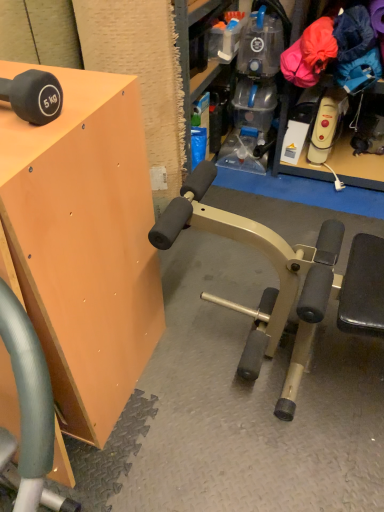
Question: Does matte black dumbbell at upper left have a greater height compared to matte orange cabinet at upper left?

Choices:
 (A) no
 (B) yes

Answer: (A)

Question: Considering the relative sizes of matte black dumbbell at upper left and matte orange cabinet at upper left in the image provided, is matte black dumbbell at upper left shorter than matte orange cabinet at upper left?

Choices:
 (A) no
 (B) yes

Answer: (B)

Question: From the image's perspective, is matte black dumbbell at upper left located above matte orange cabinet at upper left?

Choices:
 (A) yes
 (B) no

Answer: (A)

Question: Is matte black dumbbell at upper left facing towards matte orange cabinet at upper left?

Choices:
 (A) yes
 (B) no

Answer: (B)

Question: Is there a large distance between matte black dumbbell at upper left and matte orange cabinet at upper left?

Choices:
 (A) no
 (B) yes

Answer: (A)

Question: Considering the relative positions of matte black dumbbell at upper left and matte orange cabinet at upper left in the image provided, is matte black dumbbell at upper left to the right of matte orange cabinet at upper left from the viewer's perspective?

Choices:
 (A) no
 (B) yes

Answer: (B)

Question: Is matte orange cabinet at upper left at the right side of matte black dumbbell at upper left?

Choices:
 (A) yes
 (B) no

Answer: (B)

Question: From a real-world perspective, is matte orange cabinet at upper left positioned under matte black dumbbell at upper left based on gravity?

Choices:
 (A) yes
 (B) no

Answer: (A)

Question: Is matte orange cabinet at upper left further to camera compared to matte black dumbbell at upper left?

Choices:
 (A) no
 (B) yes

Answer: (A)

Question: Considering the relative sizes of matte orange cabinet at upper left and matte black dumbbell at upper left in the image provided, is matte orange cabinet at upper left smaller than matte black dumbbell at upper left?

Choices:
 (A) no
 (B) yes

Answer: (A)

Question: Is matte orange cabinet at upper left bigger than matte black dumbbell at upper left?

Choices:
 (A) no
 (B) yes

Answer: (B)

Question: Is matte orange cabinet at upper left facing away from matte black dumbbell at upper left?

Choices:
 (A) no
 (B) yes

Answer: (A)

Question: From the image's perspective, is matte orange cabinet at upper left positioned above or below matte black dumbbell at upper left?

Choices:
 (A) above
 (B) below

Answer: (B)